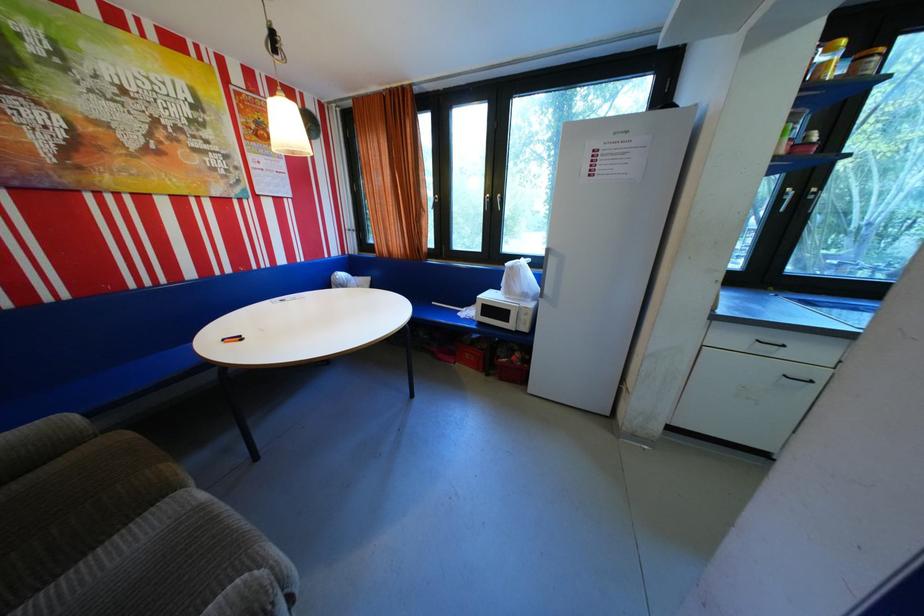
Where would you pull the white refrigerator handle? Please return your answer as a coordinate pair (x, y).

(551, 274)